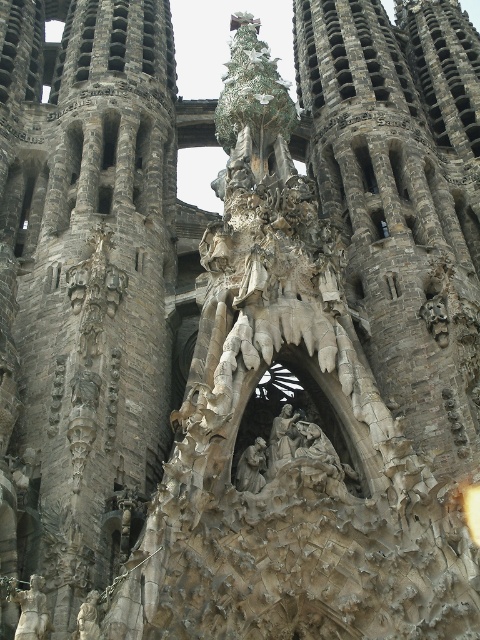
Which of these two, green textured tree at center or white stone statue at lower left, stands shorter?

With less height is white stone statue at lower left.

Looking at this image, can you confirm if green textured tree at center is taller than white stone statue at lower left?

Indeed, green textured tree at center has a greater height compared to white stone statue at lower left.

Which is in front, point (285, 125) or point (37, 612)?

Point (37, 612) is more forward.

Identify the location of green textured tree at center. 253,100.

Does point (257, 442) come closer to viewer compared to point (96, 636)?

No, it is behind (96, 636).

Is point (253, 449) positioned after point (88, 604)?

Yes, point (253, 449) is behind point (88, 604).

The image size is (480, 640). I want to click on gray stone statue at center, so click(252, 467).

Who is more distant from viewer, (32, 576) or (243, 481)?

The point (243, 481) is behind.

Does white stone statue at lower left appear on the right side of gray stone statue at center?

Incorrect, white stone statue at lower left is not on the right side of gray stone statue at center.

I want to click on white stone statue at lower left, so click(32, 611).

Where is `white stone statue at lower left`? The image size is (480, 640). white stone statue at lower left is located at coordinates (x=32, y=611).